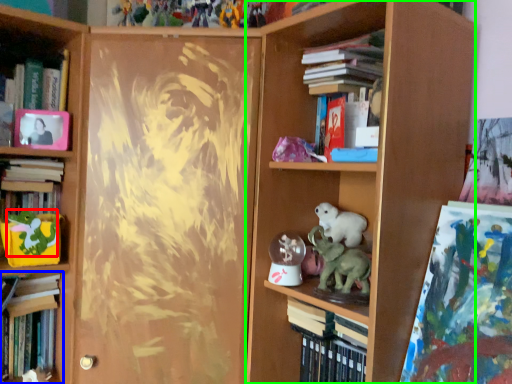
Question: Which is nearer to the animal (highlighted by a red box)? book (highlighted by a blue box) or bookcase (highlighted by a green box).

Choices:
 (A) book
 (B) bookcase

Answer: (A)